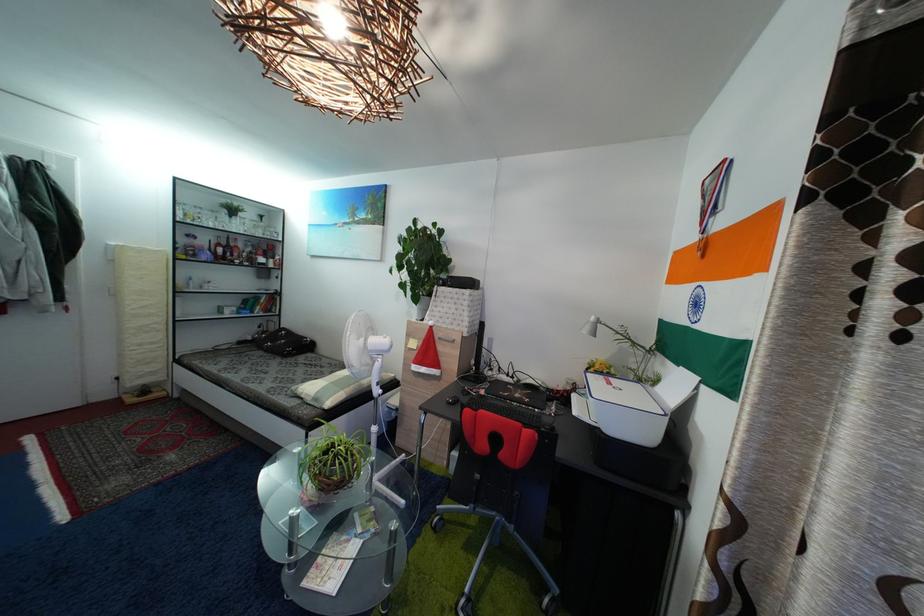
Which object does [217,249] point to?

It corresponds to the red liquor bottle in the image.